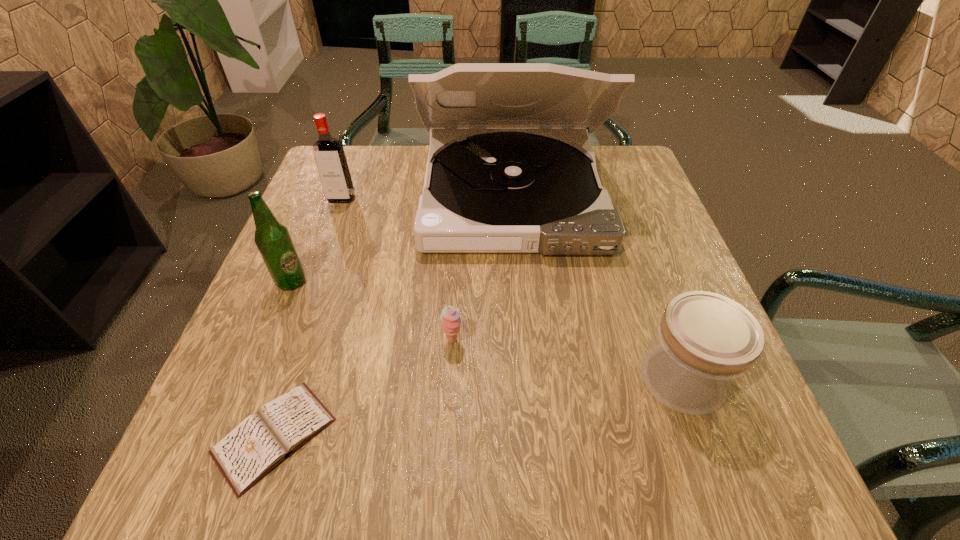
The height and width of the screenshot is (540, 960). In order to click on object present at the far left corner in this screenshot , I will do `click(332, 165)`.

Locate an element on the screen. The image size is (960, 540). object at the near left corner is located at coordinates (260, 442).

You are a GUI agent. You are given a task and a screenshot of the screen. Output one action in this format:
    pyautogui.click(x=<x>, y=<y>)
    Task: Click on the object that is at the far right corner
    
    Given the screenshot: What is the action you would take?
    (x=502, y=177)

I want to click on vacant region at the far edge of the desktop, so click(384, 154).

The height and width of the screenshot is (540, 960). What are the coordinates of `free space at the left edge` in the screenshot? It's located at (211, 426).

You are a GUI agent. You are given a task and a screenshot of the screen. Output one action in this format:
    pyautogui.click(x=<x>, y=<y>)
    Task: Click on the vacant space at the right edge
    
    Given the screenshot: What is the action you would take?
    (x=630, y=300)

At what (x,y) coordinates should I click in order to perform the action: click on free location at the far left corner. Please return your answer as a coordinate pair (x, y). This screenshot has height=540, width=960. Looking at the image, I should click on (368, 183).

What are the coordinates of `vacant space at the far right corner` in the screenshot? It's located at (624, 147).

Where is `vacant space at the near right corner`? vacant space at the near right corner is located at coordinates (737, 500).

This screenshot has width=960, height=540. I want to click on vacant area that lies between the fifth tallest object and the tallest object, so click(x=482, y=268).